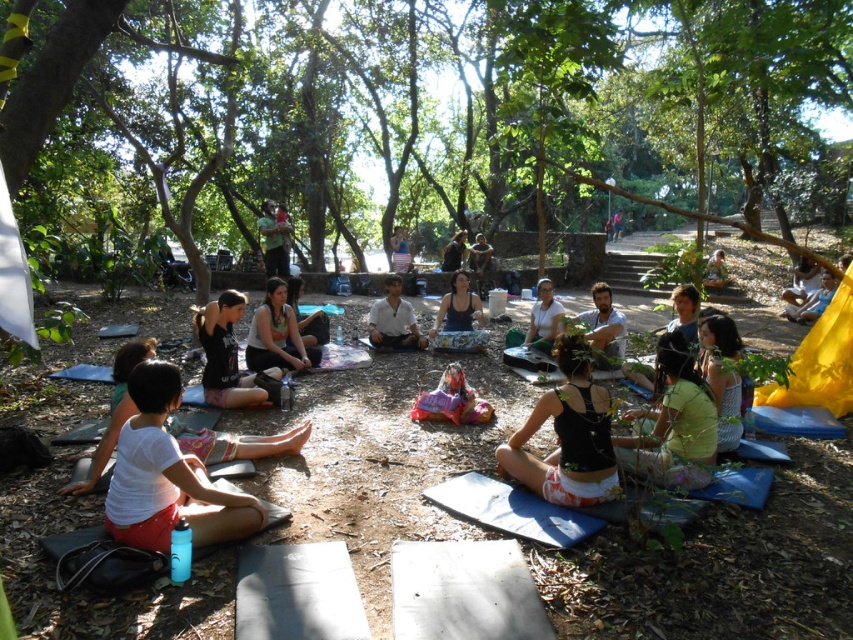
Question: Which object is positioned closest to the matte black tank top at center?

Choices:
 (A) matte white tank top at center
 (B) black fabric shorts at center
 (C) black fabric person at center

Answer: (C)

Question: Can you confirm if black fabric person at center is wider than matte white tank top at center?

Choices:
 (A) no
 (B) yes

Answer: (B)

Question: Which object is farther from the camera taking this photo?

Choices:
 (A) black fabric shorts at center
 (B) matte gray shirt at center
 (C) white cotton shirt at center
 (D) knitted light blue sweater at lower right

Answer: (C)

Question: Which point is closer to the camera?

Choices:
 (A) matte white tank top at center
 (B) black fabric tank top at center
 (C) black fabric person at center

Answer: (B)

Question: Is white cotton shirt at center to the left of matte white tank top at center from the viewer's perspective?

Choices:
 (A) yes
 (B) no

Answer: (A)

Question: Can you confirm if black fabric person at center is positioned to the right of matte gray shirt at center?

Choices:
 (A) yes
 (B) no

Answer: (B)